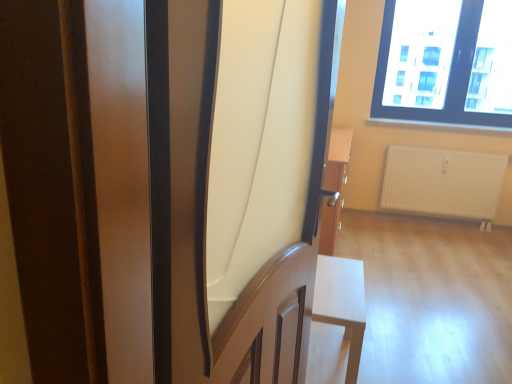
This screenshot has height=384, width=512. What do you see at coordinates (342, 303) in the screenshot?
I see `white matte table at lower right` at bounding box center [342, 303].

Locate an element on the screen. The height and width of the screenshot is (384, 512). transparent glass window at upper right is located at coordinates (445, 63).

Considering the positions of point (197, 128) and point (353, 303), is point (197, 128) closer or farther from the camera than point (353, 303)?

Point (197, 128) is positioned closer to the camera compared to point (353, 303).

In order to click on screen door on the left of white matte table at lower right in this screenshot , I will do click(206, 210).

Considering the relative positions of matte wood screen door at center and white matte table at lower right in the image provided, is matte wood screen door at center in front of white matte table at lower right?

Yes, matte wood screen door at center is closer to the camera.

From the picture: Between matte wood screen door at center and white matte table at lower right, which one has larger width?

white matte table at lower right.

Where is `window above the white matte radiator at lower right (from the image's perspective)`? This screenshot has height=384, width=512. window above the white matte radiator at lower right (from the image's perspective) is located at coordinates (445, 63).

Considering the positions of objects white matte radiator at lower right and transparent glass window at upper right in the image provided, who is more to the right, white matte radiator at lower right or transparent glass window at upper right?

Positioned to the right is white matte radiator at lower right.

Is white matte radiator at lower right turned away from transparent glass window at upper right?

white matte radiator at lower right does not have its back to transparent glass window at upper right.

Considering the relative sizes of white matte radiator at lower right and transparent glass window at upper right in the image provided, is white matte radiator at lower right taller than transparent glass window at upper right?

No, white matte radiator at lower right is not taller than transparent glass window at upper right.

Is matte wood screen door at center shorter than transparent glass window at upper right?

No.

Identify the location of window behind the matte wood screen door at center. (445, 63).

How different are the orientations of matte wood screen door at center and transparent glass window at upper right in degrees?

The angle between the facing direction of matte wood screen door at center and the facing direction of transparent glass window at upper right is 75.8 degrees.

Is white matte table at lower right a part of transparent glass window at upper right?

Actually, white matte table at lower right is outside transparent glass window at upper right.

Which of these two, transparent glass window at upper right or white matte table at lower right, is smaller?

With smaller size is white matte table at lower right.

From the image's perspective, is transparent glass window at upper right positioned above or below white matte table at lower right?

transparent glass window at upper right is situated higher than white matte table at lower right in the image.

Can matte wood screen door at center be found inside white matte radiator at lower right?

Actually, matte wood screen door at center is outside white matte radiator at lower right.

Considering the sizes of objects white matte radiator at lower right and matte wood screen door at center in the image provided, who is taller, white matte radiator at lower right or matte wood screen door at center?

Standing taller between the two is matte wood screen door at center.

Which is nearer, (487,199) or (164,129)?

The point (164,129) is closer to the camera.

From a real-world perspective, which object rests below the other?

white matte radiator at lower right, from a real-world perspective.

Are white matte radiator at lower right and white matte table at lower right far apart?

Yes, white matte radiator at lower right is far from white matte table at lower right.

From their relative heights in the image, would you say white matte radiator at lower right is taller or shorter than white matte table at lower right?

white matte radiator at lower right is taller than white matte table at lower right.

Can you confirm if white matte radiator at lower right is positioned to the right of white matte table at lower right?

Yes.

Which object is wider, white matte radiator at lower right or white matte table at lower right?

With larger width is white matte table at lower right.

Is matte wood screen door at center behind white matte radiator at lower right?

No, it is in front of white matte radiator at lower right.

Looking at this image, is matte wood screen door at center thinner than white matte radiator at lower right?

Incorrect, the width of matte wood screen door at center is not less than that of white matte radiator at lower right.

Can you tell me how much matte wood screen door at center and white matte radiator at lower right differ in facing direction?

75.7 degrees.

The height and width of the screenshot is (384, 512). I want to click on furniture located below the matte wood screen door at center (from the image's perspective), so click(x=342, y=303).

Locate an element on the screen. The height and width of the screenshot is (384, 512). radiator behind the transparent glass window at upper right is located at coordinates (443, 183).

Considering their positions, is transparent glass window at upper right positioned closer to white matte radiator at lower right than white matte table at lower right?

transparent glass window at upper right lies closer to white matte radiator at lower right than the other object.

Considering their positions, is white matte table at lower right positioned further to white matte radiator at lower right than matte wood screen door at center?

The object further to white matte radiator at lower right is matte wood screen door at center.

Looking at the image, which one is located closer to transparent glass window at upper right, matte wood screen door at center or white matte radiator at lower right?

Based on the image, white matte radiator at lower right appears to be nearer to transparent glass window at upper right.

Which object lies further to the anchor point matte wood screen door at center, transparent glass window at upper right or white matte table at lower right?

transparent glass window at upper right.

Which object lies nearer to the anchor point matte wood screen door at center, white matte table at lower right or transparent glass window at upper right?

Among the two, white matte table at lower right is located nearer to matte wood screen door at center.

Which object lies nearer to the anchor point white matte table at lower right, matte wood screen door at center or white matte radiator at lower right?

matte wood screen door at center lies closer to white matte table at lower right than the other object.

Considering their positions, is white matte radiator at lower right positioned closer to white matte table at lower right than transparent glass window at upper right?

Based on the image, white matte radiator at lower right appears to be nearer to white matte table at lower right.

Based on their spatial positions, is matte wood screen door at center or transparent glass window at upper right further from white matte radiator at lower right?

matte wood screen door at center is positioned further to the anchor white matte radiator at lower right.

This screenshot has width=512, height=384. Identify the location of window located between matte wood screen door at center and white matte radiator at lower right in the depth direction. (445, 63).

Find the location of a particular element. window between white matte table at lower right and white matte radiator at lower right in the front-back direction is located at coordinates (445, 63).

The height and width of the screenshot is (384, 512). Find the location of `furniture between matte wood screen door at center and transparent glass window at upper right from front to back`. furniture between matte wood screen door at center and transparent glass window at upper right from front to back is located at coordinates [342, 303].

This screenshot has width=512, height=384. I want to click on furniture located between matte wood screen door at center and white matte radiator at lower right in the depth direction, so click(342, 303).